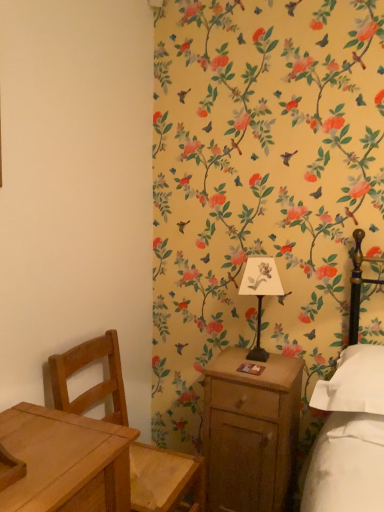
Locate an element on the screen. The image size is (384, 512). free location above wooden nightstand at right (from a real-world perspective) is located at coordinates (255, 369).